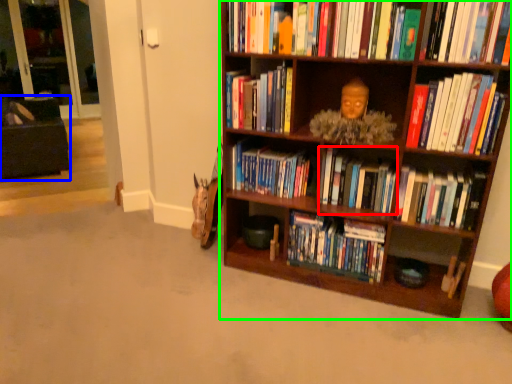
Question: Estimate the real-world distances between objects in this image. Which object is farther from book (highlighted by a red box), bean bag chair (highlighted by a blue box) or bookcase (highlighted by a green box)?

Choices:
 (A) bean bag chair
 (B) bookcase

Answer: (A)